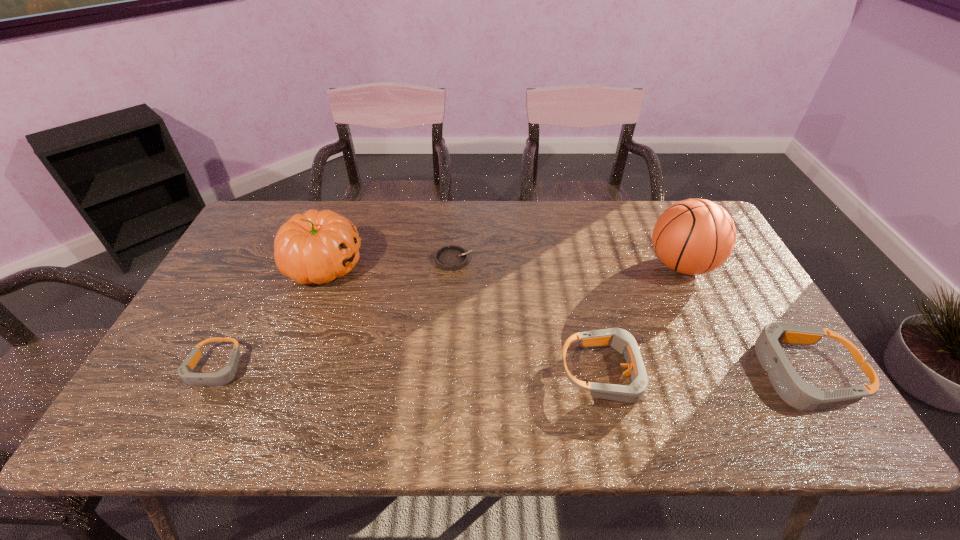
The image size is (960, 540). I want to click on goggles that stands as the closest to the rightmost goggles, so click(x=621, y=340).

Point out which goggles is positioned as the second nearest to the second shortest goggles. Please provide its 2D coordinates. Your answer should be formatted as a tuple, i.e. [(x, y)], where the tuple contains the x and y coordinates of a point satisfying the conditions above.

[(225, 375)]

You are a GUI agent. You are given a task and a screenshot of the screen. Output one action in this format:
    pyautogui.click(x=<x>, y=<y>)
    Task: Click on the vacant position in the image that satisfies the following two spatial constraints: 1. on the carved face of the fifth shortest object; 2. on the left side of the basketball
    The width and height of the screenshot is (960, 540).
    Given the screenshot: What is the action you would take?
    pyautogui.click(x=324, y=265)